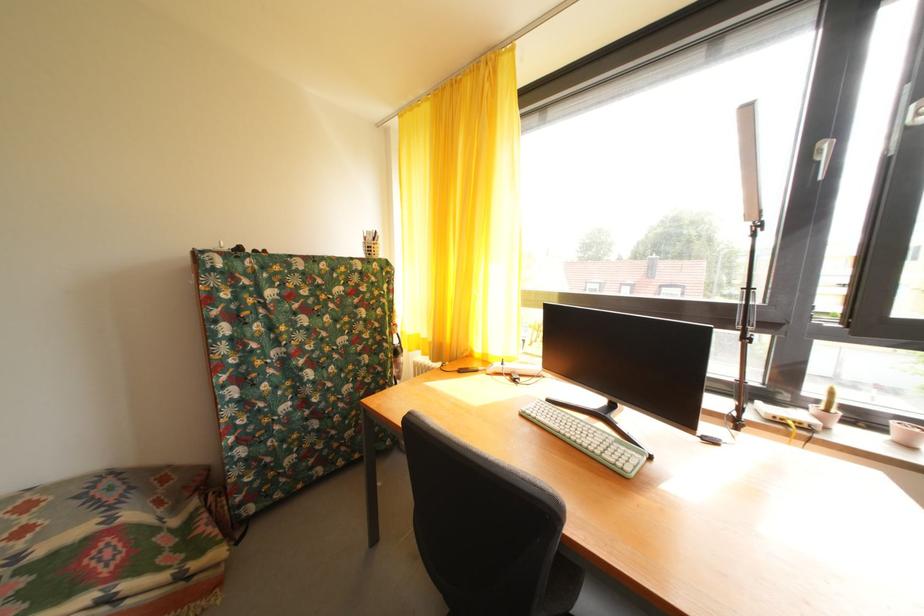
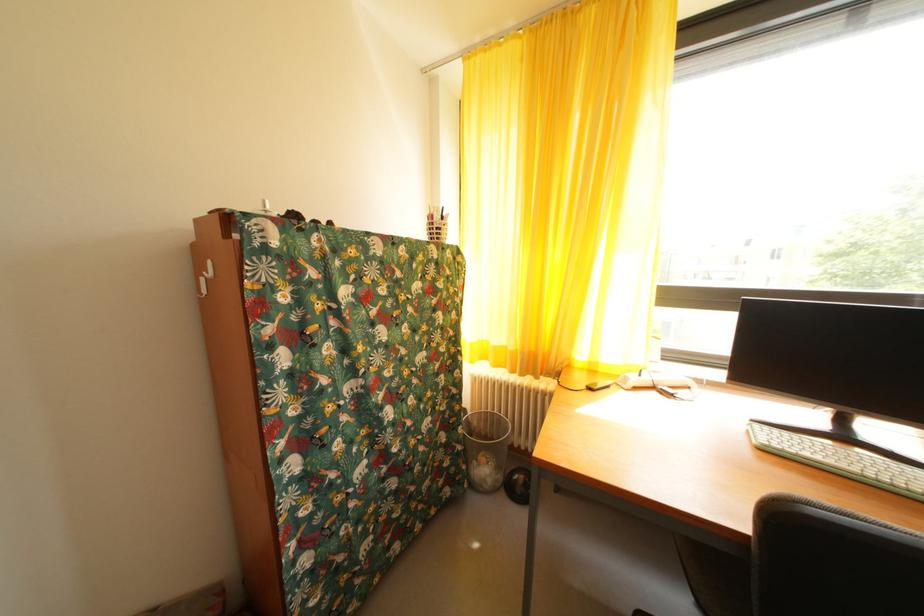
Question: The images are taken continuously from a first-person perspective. In which direction is your viewpoint rotating?

Choices:
 (A) Left
 (B) Right
 (C) Up
 (D) Down

Answer: (B)